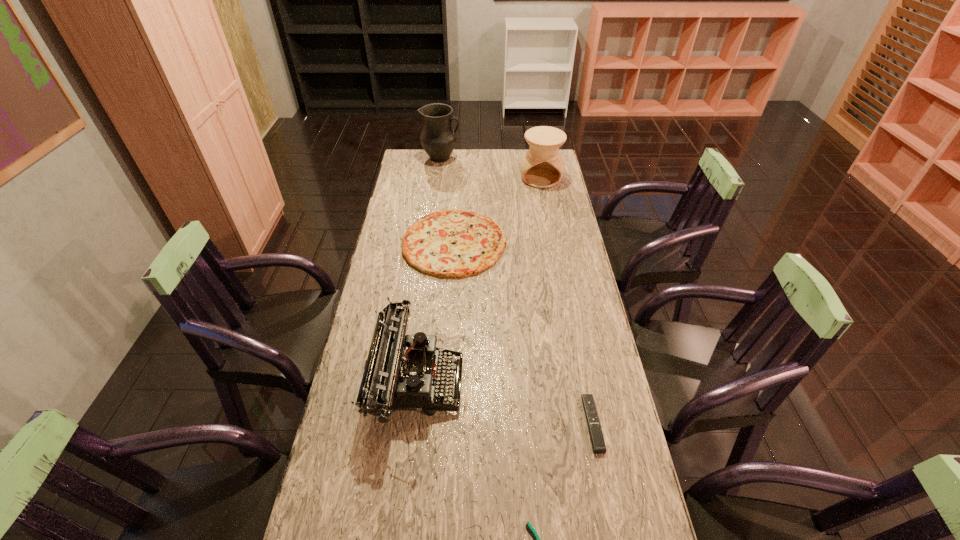
Locate an element on the screen. vacant region at the far edge of the desktop is located at coordinates (478, 168).

Locate an element on the screen. This screenshot has height=540, width=960. free space at the left edge is located at coordinates (370, 432).

Find the location of a particular element. free space at the right edge of the desktop is located at coordinates (554, 340).

Where is `vacant space at the far left corner of the desktop`? vacant space at the far left corner of the desktop is located at coordinates (423, 154).

This screenshot has width=960, height=540. Identify the location of vacant point located between the typewriter and the remote control. (505, 402).

This screenshot has width=960, height=540. I want to click on vacant area that lies between the fifth tallest object and the third shortest object, so click(x=523, y=333).

Identify the location of vacant space that's between the third farthest object and the remote control. This screenshot has width=960, height=540. (523, 333).

Identify which object is located as the second nearest to the remote control. Please provide its 2D coordinates. Your answer should be formatted as a tuple, i.e. [(x, y)], where the tuple contains the x and y coordinates of a point satisfying the conditions above.

[(402, 372)]

Choose which object is the fourth nearest neighbor to the typewriter. Please provide its 2D coordinates. Your answer should be formatted as a tuple, i.e. [(x, y)], where the tuple contains the x and y coordinates of a point satisfying the conditions above.

[(542, 166)]

Locate an element on the screen. The height and width of the screenshot is (540, 960). vacant position in the image that satisfies the following two spatial constraints: 1. on the back side of the third shortest object; 2. on the handle side of the pitcher is located at coordinates (460, 158).